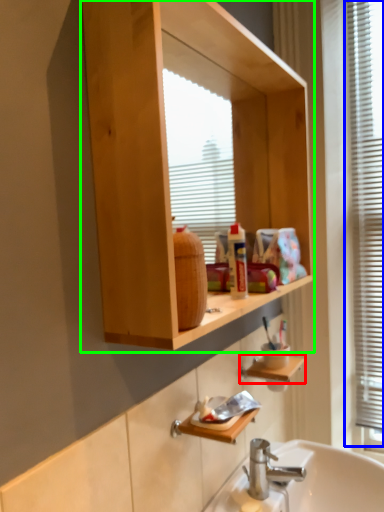
Question: Which object is the closest to the cabinet (highlighted by a red box)? Choose among these: window frame (highlighted by a blue box) or bathroom cabinet (highlighted by a green box).

Choices:
 (A) window frame
 (B) bathroom cabinet

Answer: (B)